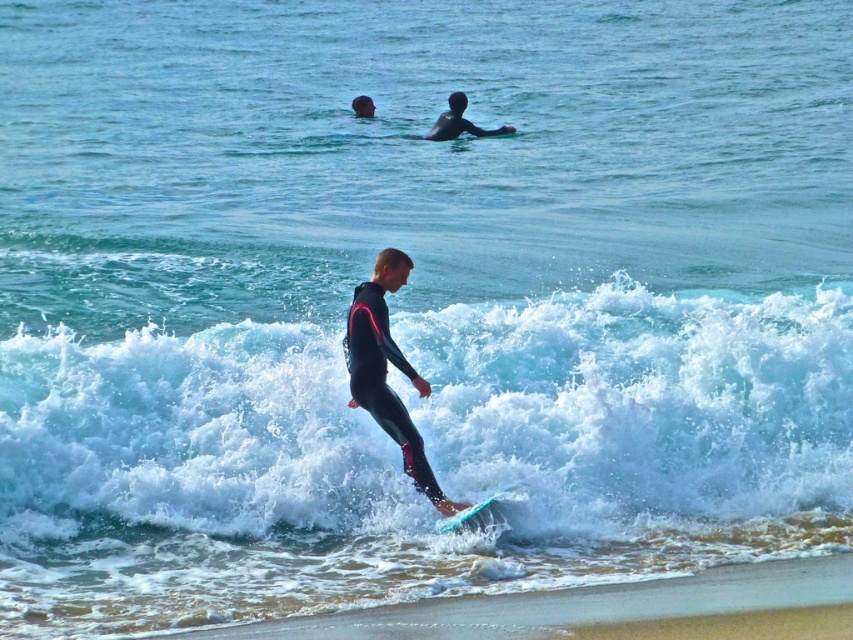
Question: Is white foamy wave at center smaller than black matte wetsuit at upper center?

Choices:
 (A) no
 (B) yes

Answer: (B)

Question: Which point is farther to the camera?

Choices:
 (A) white foamy wave at center
 (B) smooth sand at lower center
 (C) black matte wetsuit at upper center
 (D) black matte wetsuit at center

Answer: (C)

Question: Which point is farther to the camera?

Choices:
 (A) black matte wetsuit at upper center
 (B) smooth sand at lower center
 (C) translucent blue surfboard at lower center
 (D) white foamy wave at center

Answer: (A)

Question: Can you confirm if white foamy wave at center is bigger than smooth sand at lower center?

Choices:
 (A) no
 (B) yes

Answer: (A)

Question: Considering the relative positions of smooth sand at lower center and translucent blue surfboard at lower center in the image provided, where is smooth sand at lower center located with respect to translucent blue surfboard at lower center?

Choices:
 (A) above
 (B) below

Answer: (B)

Question: Which object appears closest to the camera in this image?

Choices:
 (A) white foamy wave at center
 (B) translucent blue surfboard at lower center
 (C) black matte wetsuit at upper center
 (D) smooth sand at lower center

Answer: (D)